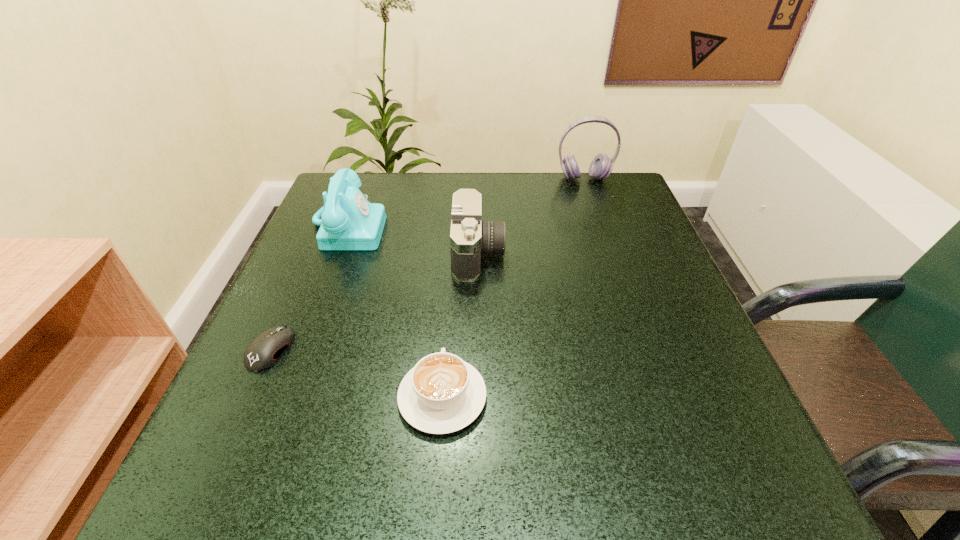
This screenshot has height=540, width=960. I want to click on vacant point located between the cappuccino and the camera, so click(461, 326).

Where is `free point between the telephone and the third tallest object`? This screenshot has width=960, height=540. free point between the telephone and the third tallest object is located at coordinates (413, 240).

The height and width of the screenshot is (540, 960). What are the coordinates of `vacant area that lies between the third tallest object and the cappuccino` in the screenshot? It's located at (461, 326).

Image resolution: width=960 pixels, height=540 pixels. What are the coordinates of `empty space between the farthest object and the fourth tallest object` in the screenshot? It's located at (514, 288).

I want to click on free spot between the third shortest object and the fourth shortest object, so coord(413,240).

Identify the location of object that ranks as the closest to the computer equipment. (349, 221).

Find the location of a particular element. Image resolution: width=960 pixels, height=540 pixels. object that ranks as the third closest to the headset is located at coordinates (442, 394).

The image size is (960, 540). What are the coordinates of `blank space that satisfies the following two spatial constraints: 1. on the side of the second shortest object with the handle; 2. on the dial of the telephone` in the screenshot? It's located at (455, 227).

What are the coordinates of `free space that satisfies the following two spatial constraints: 1. on the headband and ear cups of the rightmost object; 2. on the dial of the telephone` in the screenshot? It's located at (601, 227).

The width and height of the screenshot is (960, 540). Find the location of `vacant area in the image that satisfies the following two spatial constraints: 1. on the headband and ear cups of the tallest object; 2. on the dial of the telephone`. vacant area in the image that satisfies the following two spatial constraints: 1. on the headband and ear cups of the tallest object; 2. on the dial of the telephone is located at coordinates (601, 227).